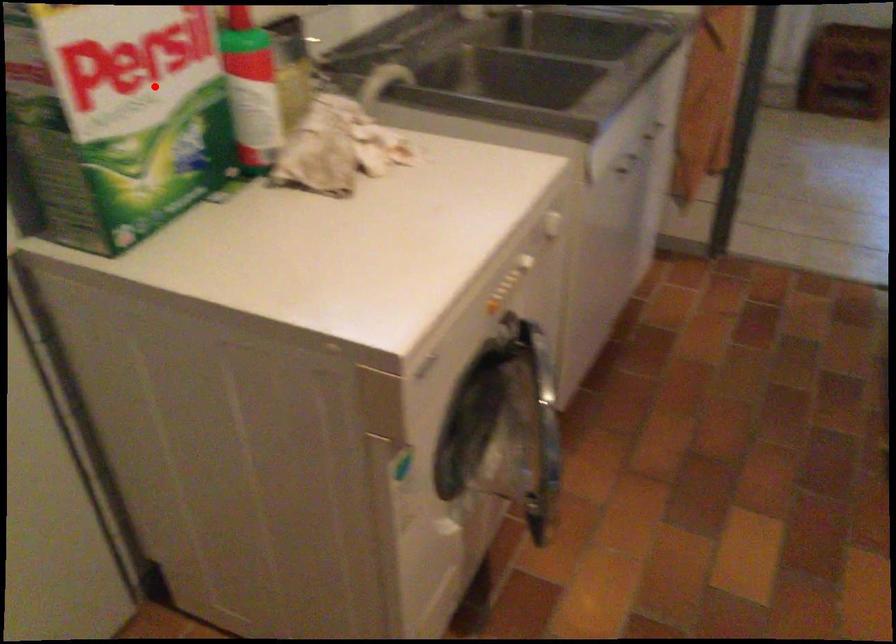
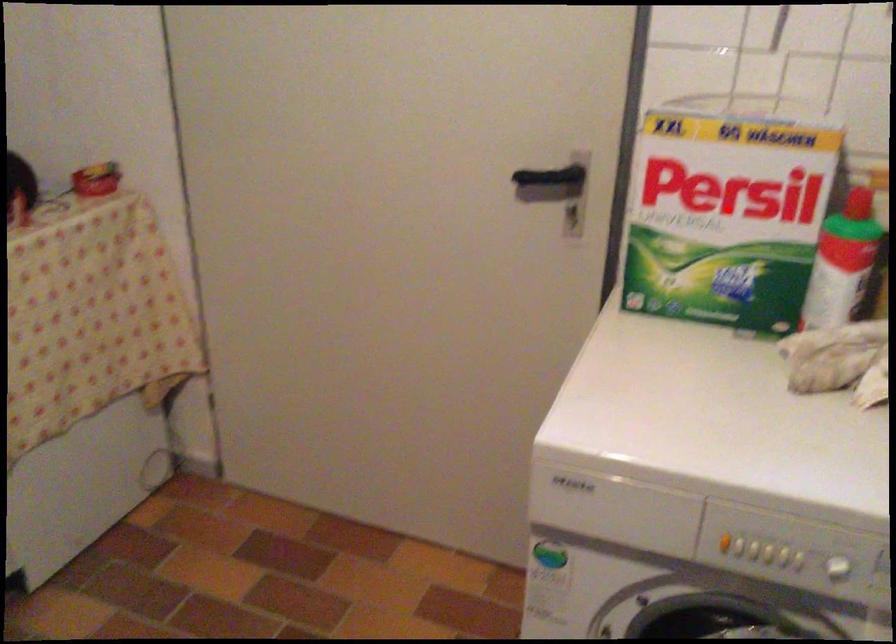
I am providing you with two images of the same scene from different viewpoints. A red point is marked on the first image and another point is marked on the second image. Is the marked point in image1 the same physical position as the marked point in image2?

Yes